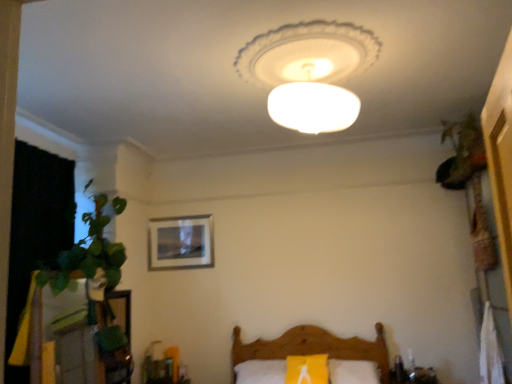
Question: Is white frosted glass lampshade at center not close to wooden bed at lower center?

Choices:
 (A) yes
 (B) no

Answer: (A)

Question: Does white frosted glass lampshade at center turn towards wooden bed at lower center?

Choices:
 (A) yes
 (B) no

Answer: (B)

Question: Considering the relative sizes of white frosted glass lampshade at center and wooden bed at lower center in the image provided, is white frosted glass lampshade at center shorter than wooden bed at lower center?

Choices:
 (A) no
 (B) yes

Answer: (B)

Question: From a real-world perspective, is white frosted glass lampshade at center positioned under wooden bed at lower center based on gravity?

Choices:
 (A) no
 (B) yes

Answer: (A)

Question: From a real-world perspective, is white frosted glass lampshade at center positioned over wooden bed at lower center based on gravity?

Choices:
 (A) yes
 (B) no

Answer: (A)

Question: Looking at their shapes, would you say wooden picture frame at center is wider or thinner than green leafy plant at upper right?

Choices:
 (A) thin
 (B) wide

Answer: (A)

Question: In terms of height, does wooden picture frame at center look taller or shorter compared to green leafy plant at upper right?

Choices:
 (A) tall
 (B) short

Answer: (A)

Question: In the image, is wooden picture frame at center positioned in front of or behind green leafy plant at upper right?

Choices:
 (A) front
 (B) behind

Answer: (B)

Question: Looking at the image, does wooden picture frame at center seem bigger or smaller compared to green leafy plant at upper right?

Choices:
 (A) small
 (B) big

Answer: (A)

Question: Is white frosted glass lampshade at center in front of or behind wooden picture frame at center in the image?

Choices:
 (A) behind
 (B) front

Answer: (B)

Question: Is white frosted glass lampshade at center wider or thinner than wooden picture frame at center?

Choices:
 (A) wide
 (B) thin

Answer: (A)

Question: Would you say white frosted glass lampshade at center is inside or outside wooden picture frame at center?

Choices:
 (A) inside
 (B) outside

Answer: (B)

Question: Is point (256, 57) closer or farther from the camera than point (156, 258)?

Choices:
 (A) farther
 (B) closer

Answer: (B)

Question: Would you say white frosted glass lampshade at center is to the left or to the right of wooden bed at lower center in the picture?

Choices:
 (A) right
 (B) left

Answer: (A)

Question: Is white frosted glass lampshade at center wider or thinner than wooden bed at lower center?

Choices:
 (A) thin
 (B) wide

Answer: (A)